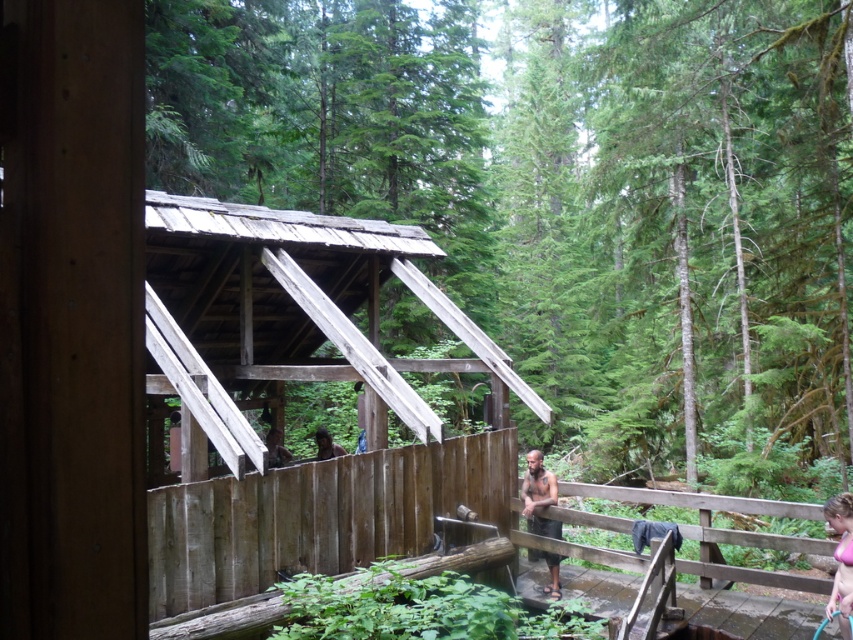
Question: Observing the image, what is the correct spatial positioning of wooden fence at center in reference to brown wooden fence at lower right?

Choices:
 (A) right
 (B) left

Answer: (B)

Question: Can you confirm if weathered wood hut at center is positioned to the left of dark brown skin at center?

Choices:
 (A) no
 (B) yes

Answer: (B)

Question: Which of these objects is positioned farthest from the pink fabric at lower right?

Choices:
 (A) weathered wood hut at center
 (B) smooth wooden structure at center
 (C) dark brown skin at center

Answer: (B)

Question: Which object is closer to the camera taking this photo?

Choices:
 (A) smooth wooden structure at center
 (B) weathered wood hut at center

Answer: (B)

Question: Which point is farther from the camera taking this photo?

Choices:
 (A) (817, 589)
 (B) (527, 525)
 (C) (308, 538)
 (D) (357, 552)

Answer: (B)

Question: Does wooden fence at center have a larger size compared to dark brown skin at center?

Choices:
 (A) yes
 (B) no

Answer: (A)